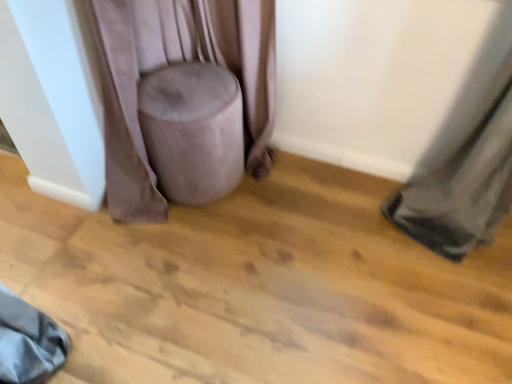
The image size is (512, 384). In order to click on free space in front of velvet beige pouf at center in this screenshot , I will do `click(196, 254)`.